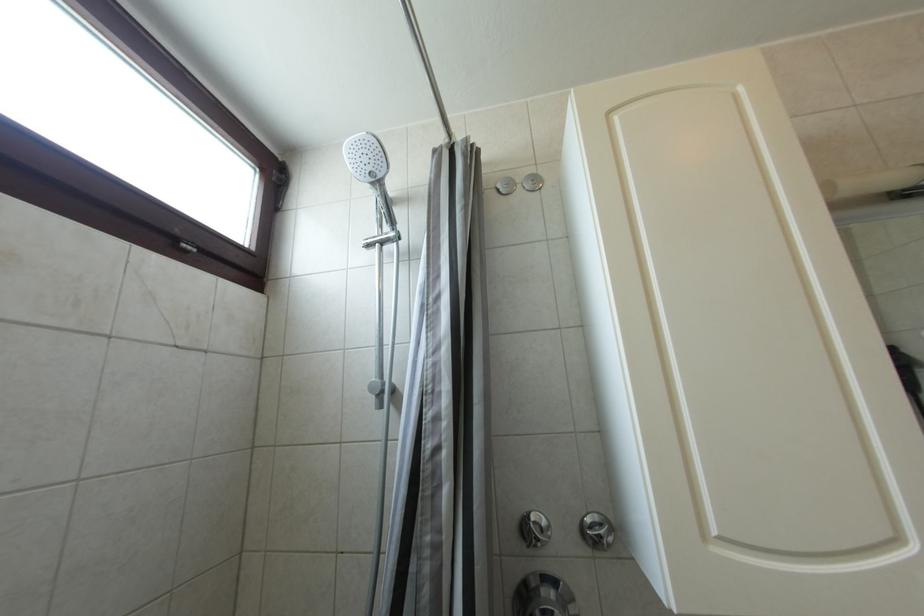
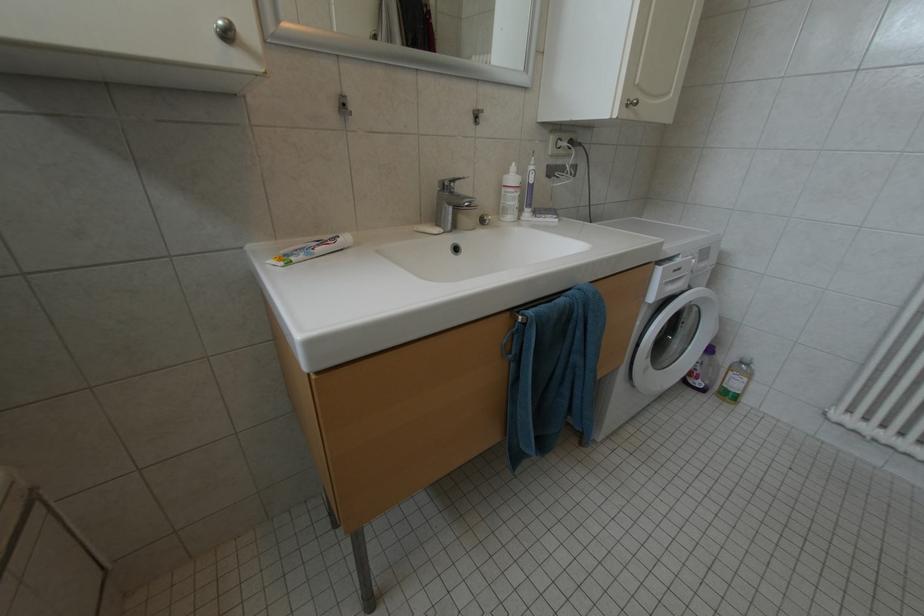
The images are taken continuously from a first-person perspective. In which direction is your viewpoint rotating?

The camera's rotation is toward right-down.